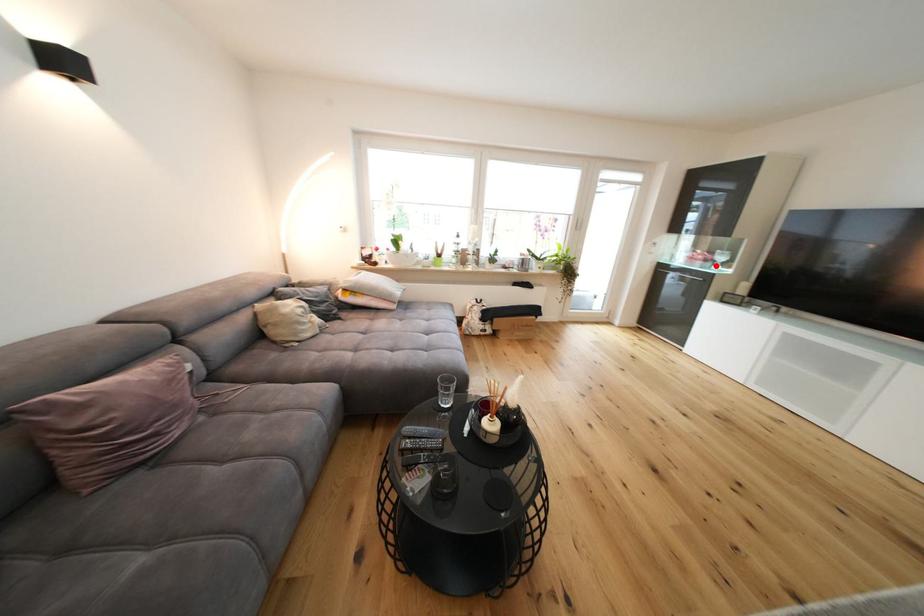
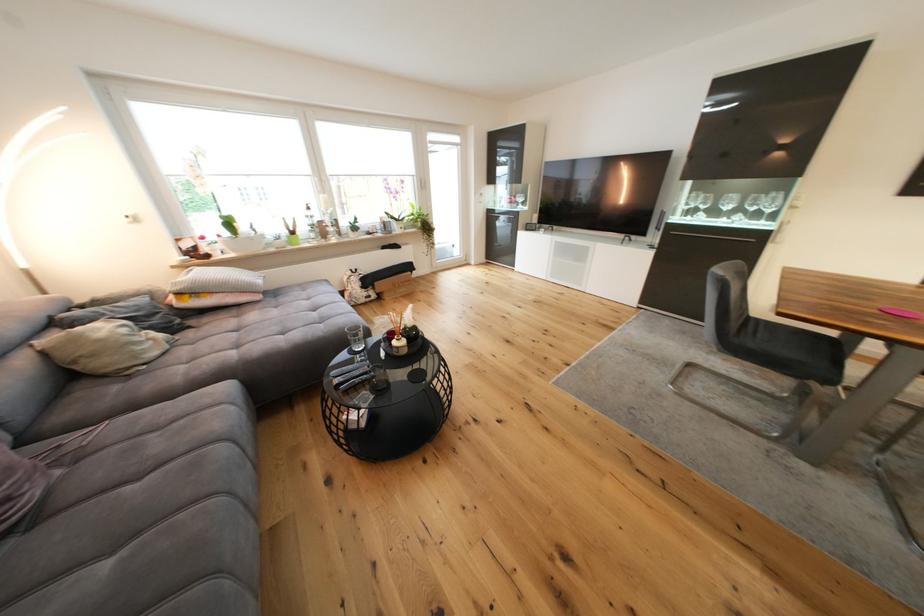
Locate, in the second image, the point that corresponds to the highlighted location in the first image.

(523, 207)